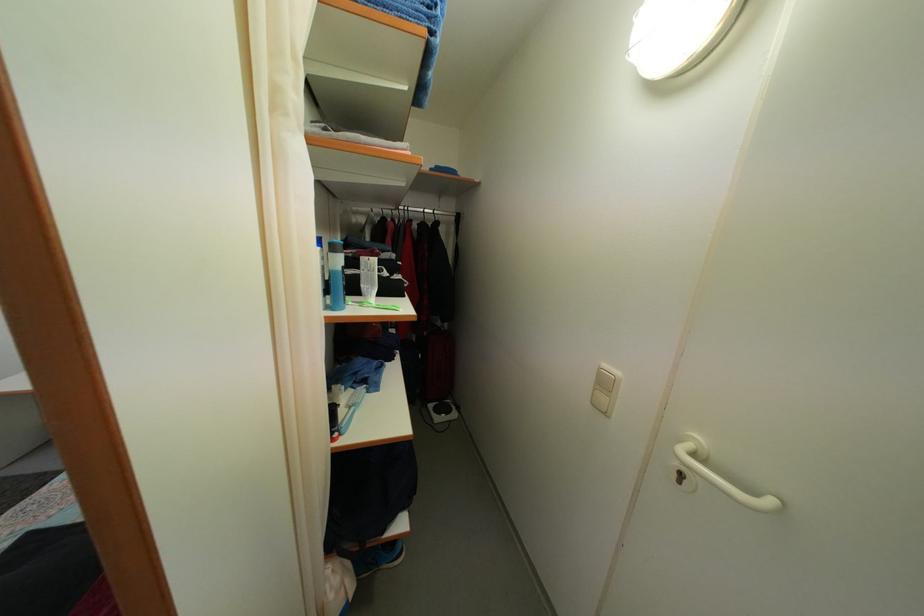
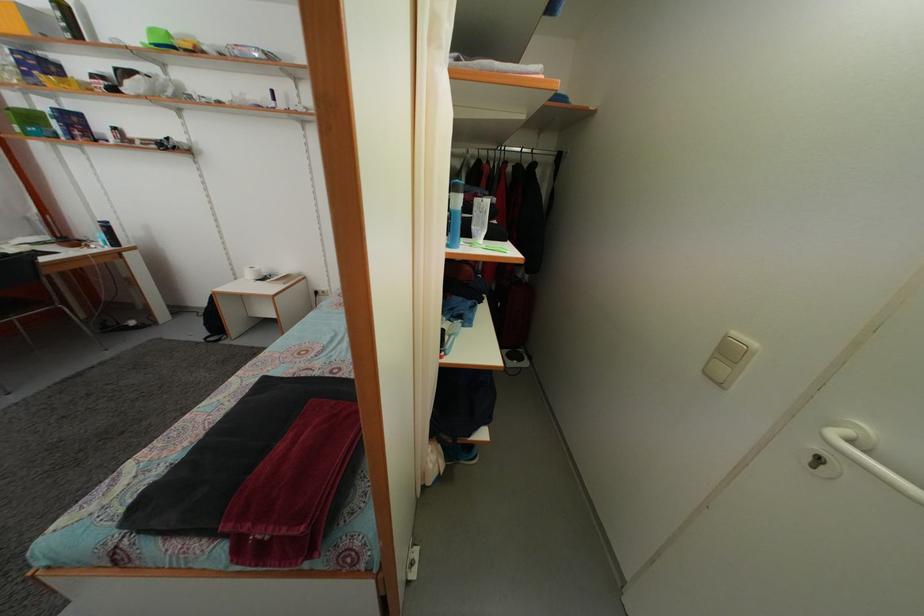
The images are taken continuously from a first-person perspective. In which direction are you moving?

The movement direction of the cameraman is left, backward.